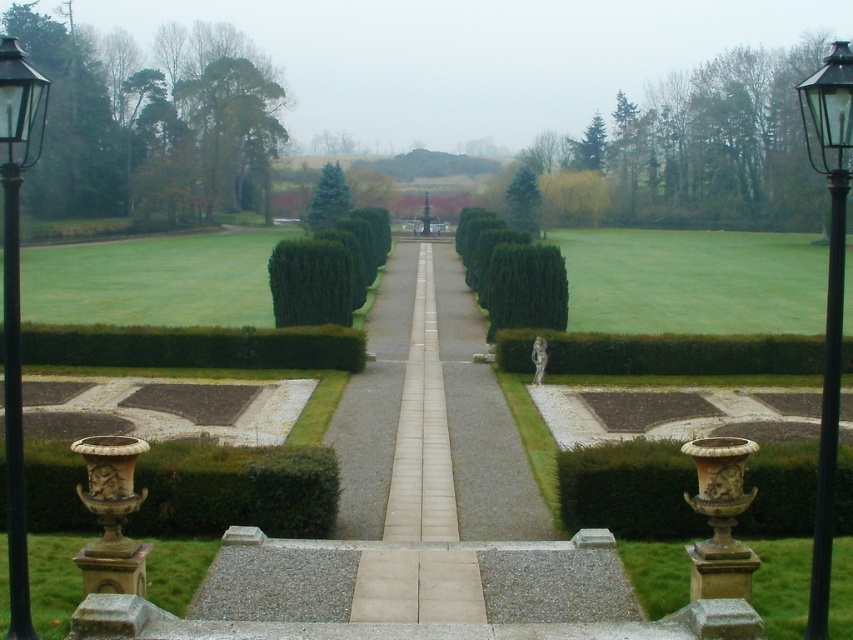
Is point (277, 532) more distant than point (608, 356)?

That is False.

Where is `green textured hedge at lower left`? This screenshot has width=853, height=640. green textured hedge at lower left is located at coordinates [236, 490].

Does point (219, 496) come behind point (531, 342)?

No, (219, 496) is in front of (531, 342).

Find the location of a particular element. green textured hedge at lower left is located at coordinates (236, 490).

Where is `black metal street light at left`? This screenshot has height=640, width=853. black metal street light at left is located at coordinates (16, 298).

Where is `black metal street light at left`? Image resolution: width=853 pixels, height=640 pixels. black metal street light at left is located at coordinates (16, 298).

Locate an element on the screen. The height and width of the screenshot is (640, 853). black metal street light at left is located at coordinates tap(16, 298).

Is green textured hedge at lower left to the left of brown stone vase at lower right from the viewer's perspective?

Correct, you'll find green textured hedge at lower left to the left of brown stone vase at lower right.

Image resolution: width=853 pixels, height=640 pixels. Find the location of `green textured hedge at lower left`. green textured hedge at lower left is located at coordinates (236, 490).